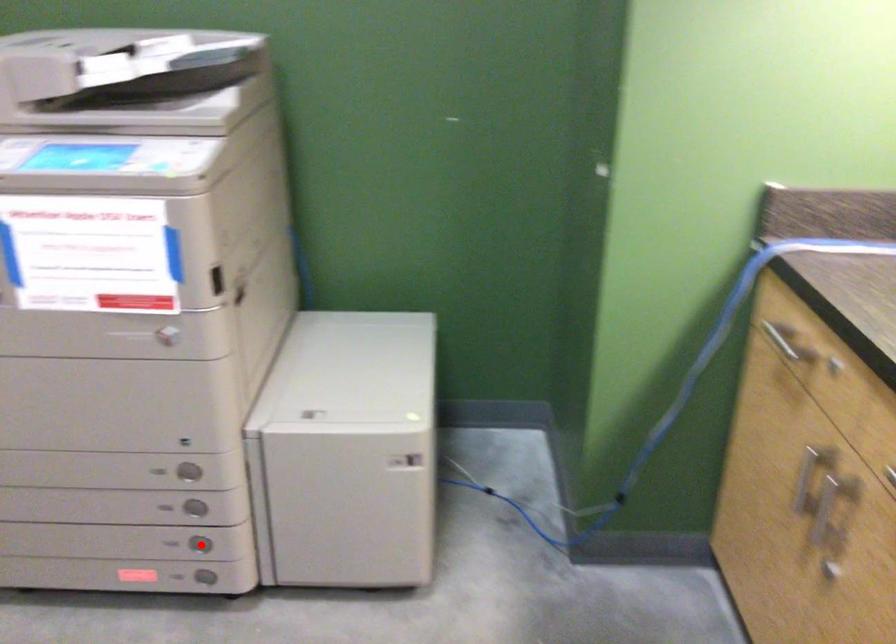
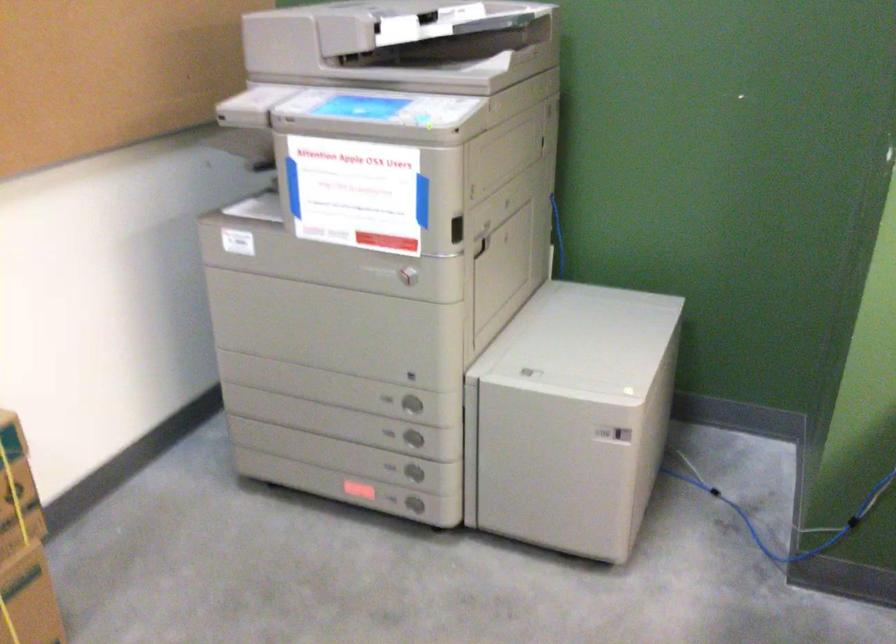
Where in the second image is the point corresponding to the highlighted location from the first image?

(412, 471)